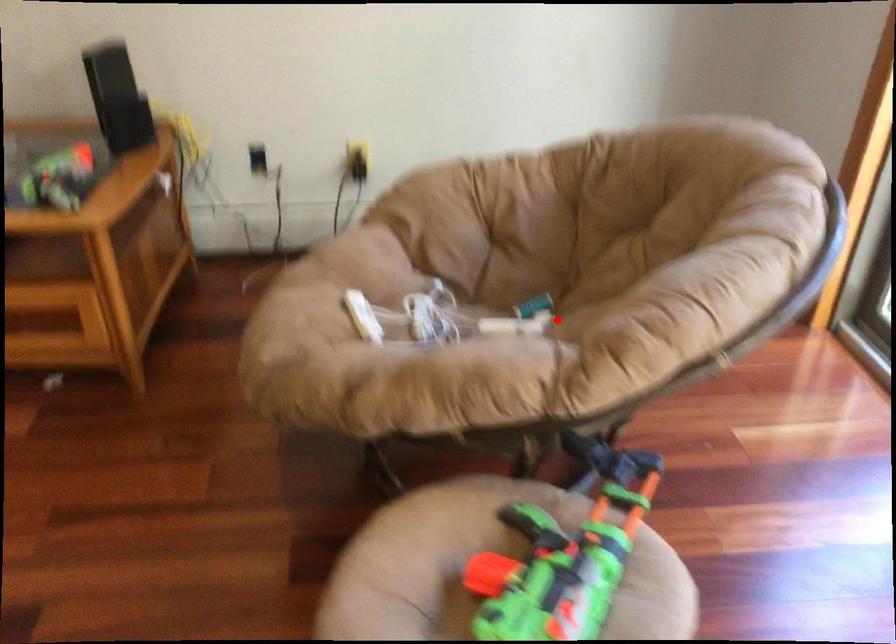
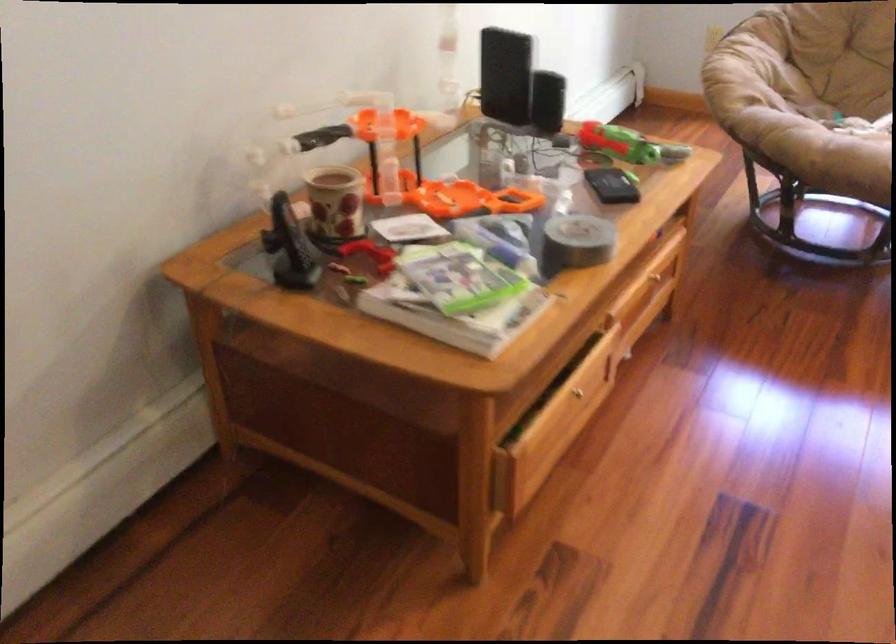
Question: A red point is marked in image1. In image2, is the corresponding 3D point closer to the camera or farther? Reply with the corresponding letter.

Choices:
 (A) The corresponding 3D point is closer.
 (B) The corresponding 3D point is farther.

Answer: (B)